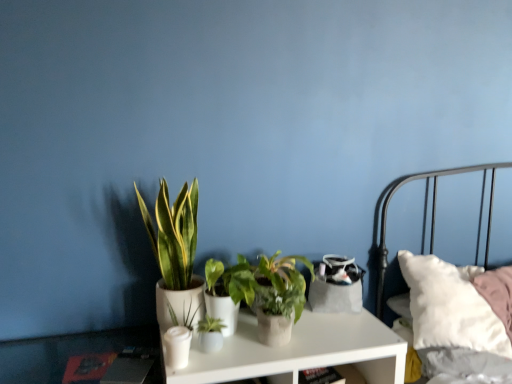
The width and height of the screenshot is (512, 384). I want to click on vacant area that is in front of green matte plant at center, which ranks as the 3th houseplant in right-to-left order, so click(211, 363).